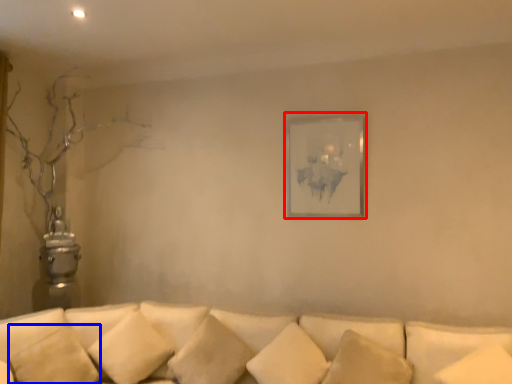
Question: Which of the following is the closest to the observer, picture frame (highlighted by a red box) or pillow (highlighted by a blue box)?

Choices:
 (A) picture frame
 (B) pillow

Answer: (B)